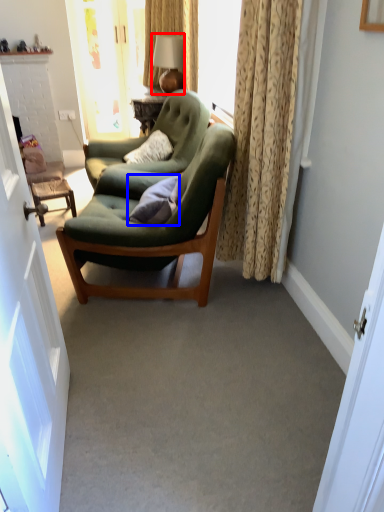
Question: Which point is closer to the camera, lamp (highlighted by a red box) or pillow (highlighted by a blue box)?

Choices:
 (A) lamp
 (B) pillow

Answer: (B)